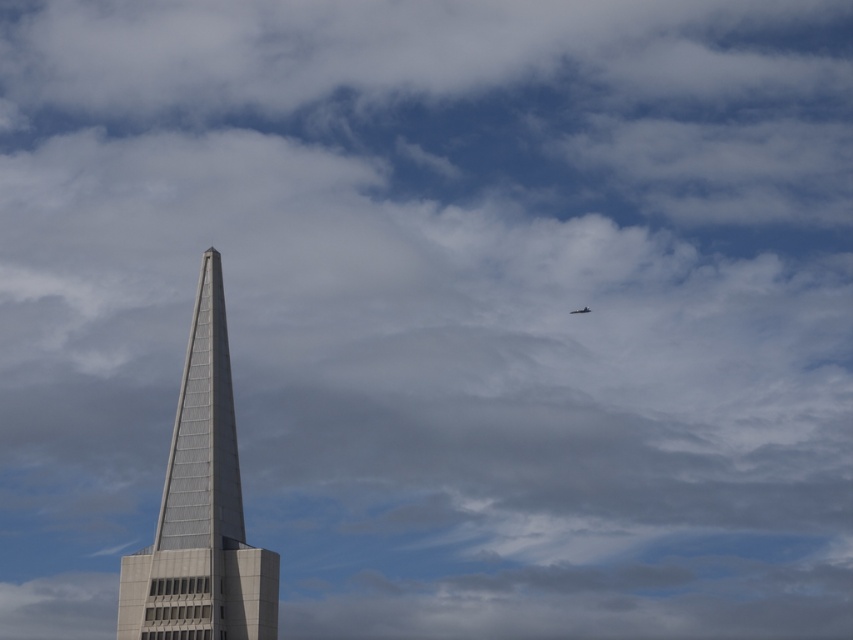
Question: Which object is farther from the camera taking this photo?

Choices:
 (A) shiny silver airplane at upper right
 (B) gray glass skyscraper at center

Answer: (A)

Question: Does gray glass skyscraper at center appear on the right side of shiny silver airplane at upper right?

Choices:
 (A) yes
 (B) no

Answer: (B)

Question: Is gray glass skyscraper at center to the left of shiny silver airplane at upper right from the viewer's perspective?

Choices:
 (A) no
 (B) yes

Answer: (B)

Question: From the image, what is the correct spatial relationship of gray glass skyscraper at center in relation to shiny silver airplane at upper right?

Choices:
 (A) below
 (B) above

Answer: (A)

Question: Which of the following is the closest to the observer?

Choices:
 (A) (216, 285)
 (B) (575, 310)

Answer: (A)